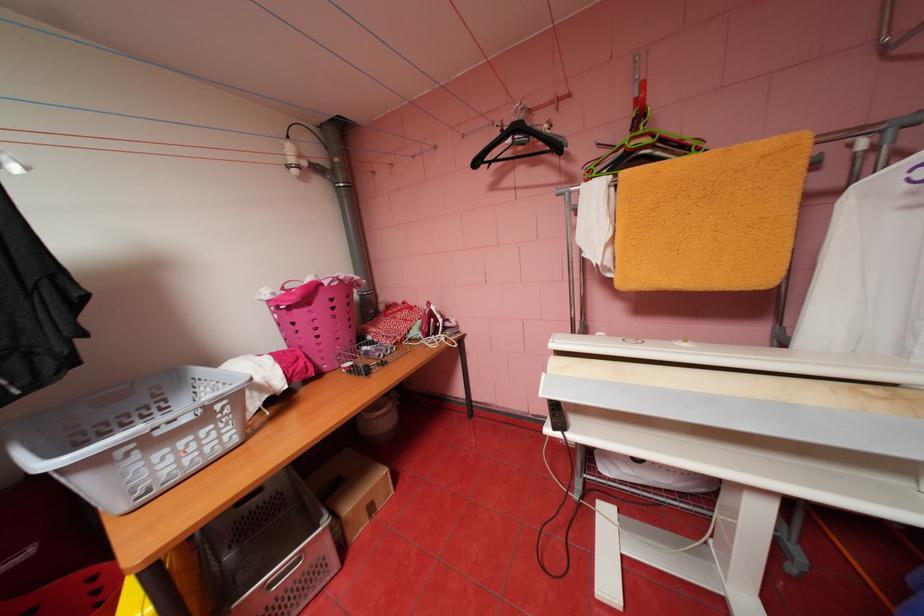
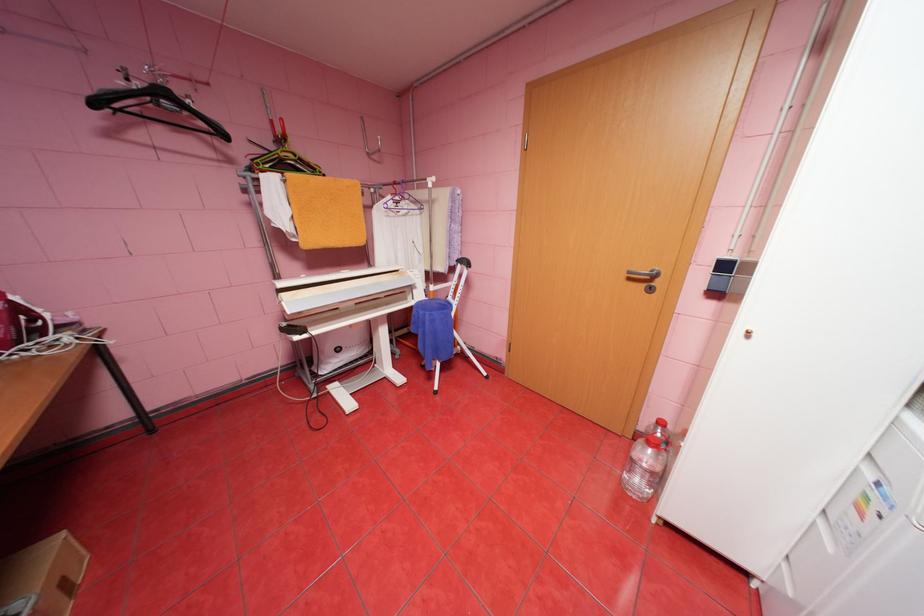
Where in the second image is the point corresponding to point (893, 50) from the first image?

(377, 154)